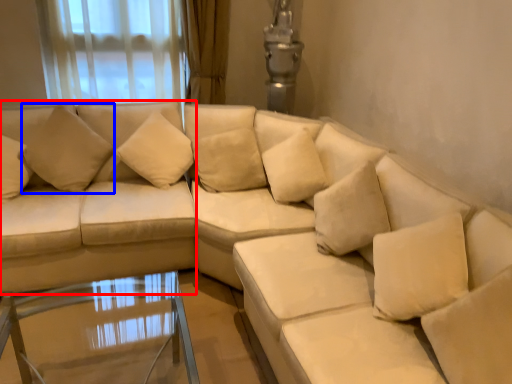
Question: Which object appears closest to the camera in this image, couch (highlighted by a red box) or pillow (highlighted by a blue box)?

Choices:
 (A) couch
 (B) pillow

Answer: (A)